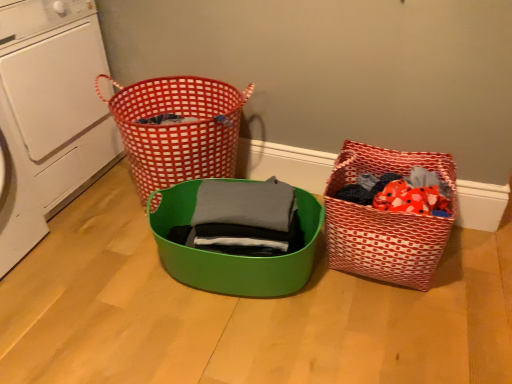
Where is `vacant space in front of red woven fabric basket at lower right, which appears as the first basket when viewed from the right`? Image resolution: width=512 pixels, height=384 pixels. vacant space in front of red woven fabric basket at lower right, which appears as the first basket when viewed from the right is located at coordinates (406, 323).